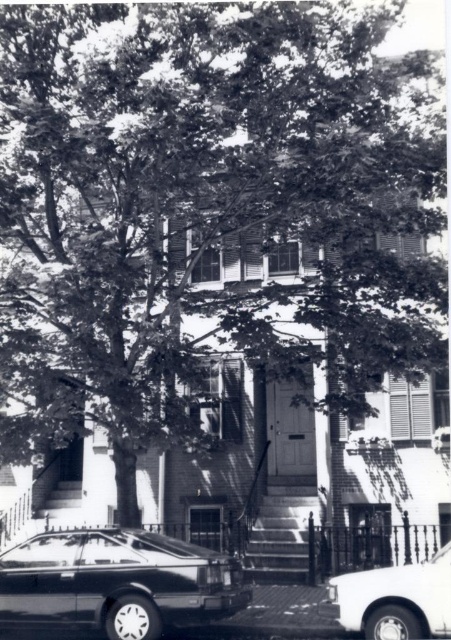
You are standing at the center of the street in front of the house. You see the shiny black sedan at lower left and the white glossy sedan at lower right. Which car is closer to the tree that shades the stairs?

The shiny black sedan at lower left is closer to the tree that shades the stairs because it is positioned to the left of the white glossy sedan at lower right, and the tree is mentioned to dominate the left side of the image.

You are standing at the point marked by coordinates point (118, 580) in the image. Looking around, what object are you most likely standing on?

The point (118, 580) corresponds to the shiny black sedan at lower left, so you are most likely standing on the shiny black sedan at lower left.